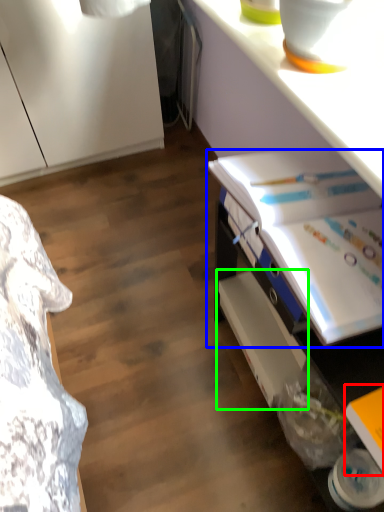
Question: Considering the real-world distances, which object is closest to book (highlighted by a red box)? book (highlighted by a blue box) or shelf (highlighted by a green box).

Choices:
 (A) book
 (B) shelf

Answer: (A)